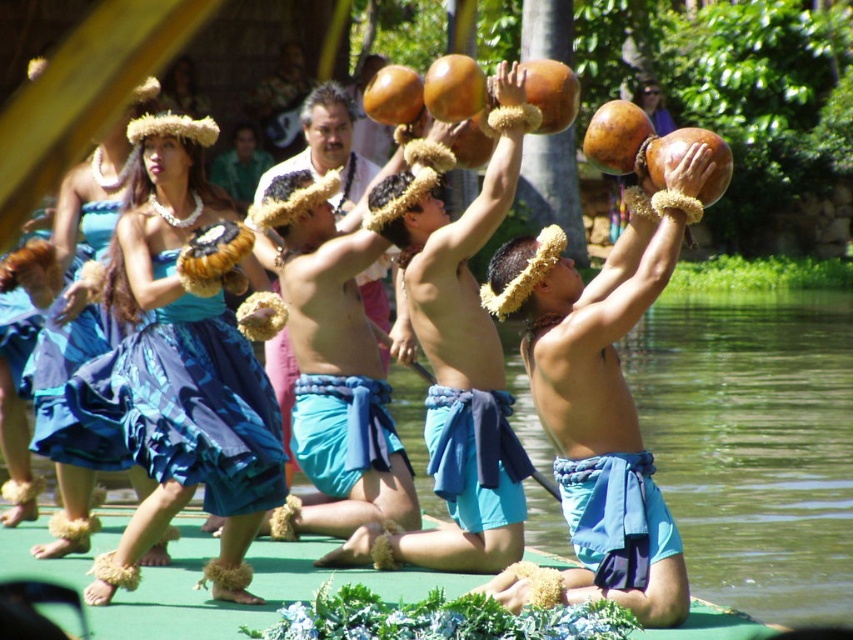
Question: Does matte coconut shell at upper center appear under smooth brown coconut at center?

Choices:
 (A) no
 (B) yes

Answer: (B)

Question: Does matte coconut shell at upper center appear on the left side of smooth brown coconut at center?

Choices:
 (A) yes
 (B) no

Answer: (B)

Question: Which of the following is the farthest from the observer?

Choices:
 (A) (x=152, y=342)
 (B) (x=486, y=355)

Answer: (B)

Question: Where is matte coconut shell at upper center located in relation to blue satin dress at center in the image?

Choices:
 (A) right
 (B) left

Answer: (A)

Question: Which point is closer to the camera?

Choices:
 (A) smooth brown coconut at center
 (B) blue satin dress at center

Answer: (B)

Question: Which object is closer to the camera taking this photo?

Choices:
 (A) smooth brown coconut at center
 (B) blue satin dress at center

Answer: (B)